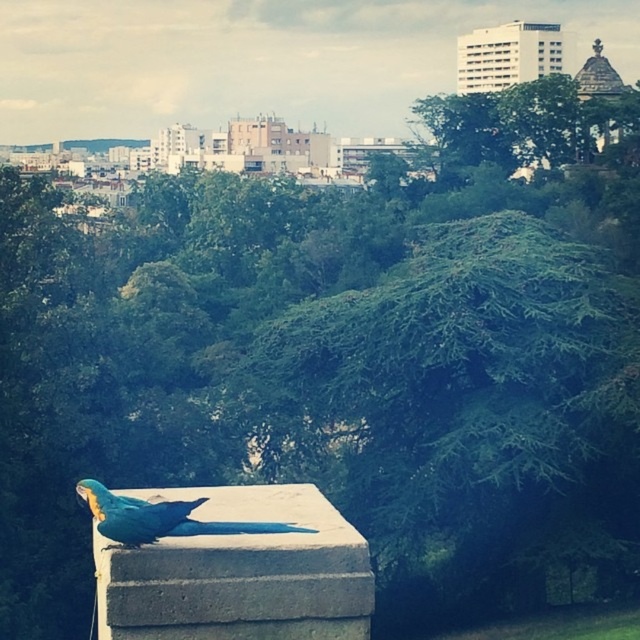
Question: Does blue concrete at center have a smaller size compared to blue glossy parrot at center?

Choices:
 (A) yes
 (B) no

Answer: (B)

Question: Which point appears closest to the camera in this image?

Choices:
 (A) (314, 614)
 (B) (188, 502)

Answer: (B)

Question: Does blue concrete at center come behind blue glossy parrot at center?

Choices:
 (A) yes
 (B) no

Answer: (B)

Question: Which point is closer to the camera?

Choices:
 (A) blue concrete at center
 (B) blue glossy parrot at center

Answer: (A)

Question: Does blue concrete at center appear on the left side of blue glossy parrot at center?

Choices:
 (A) no
 (B) yes

Answer: (A)